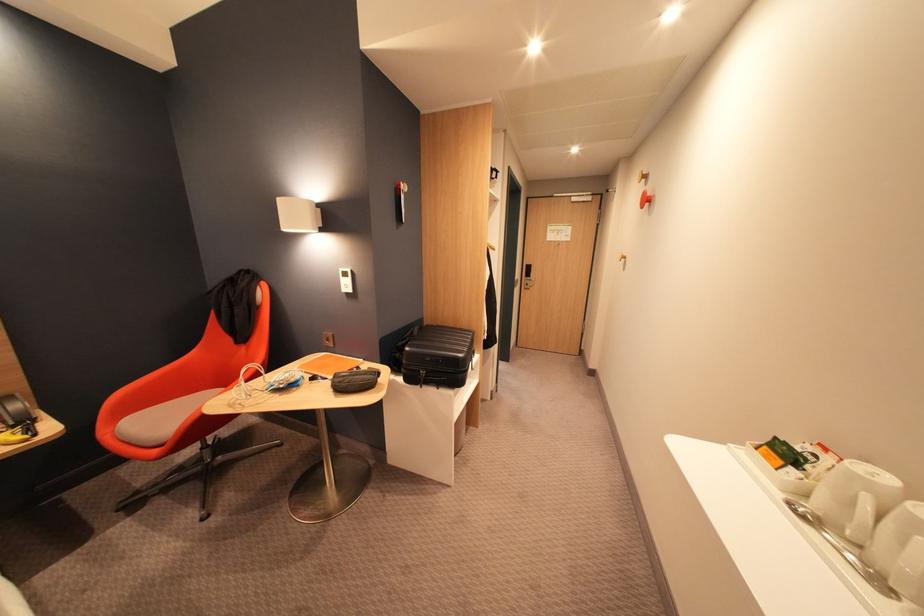
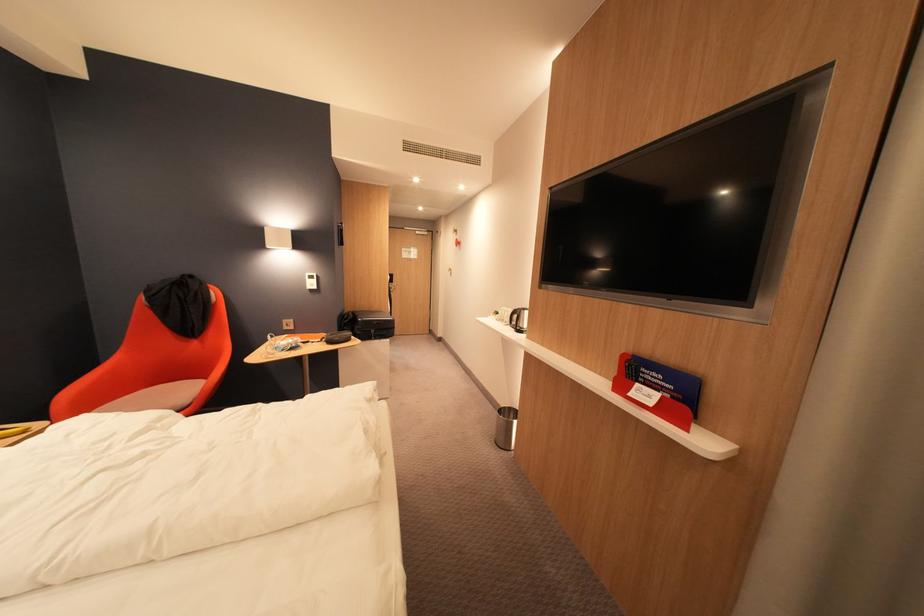
The point at (417,350) is marked in the first image. Where is the corresponding point in the second image?

(370, 321)